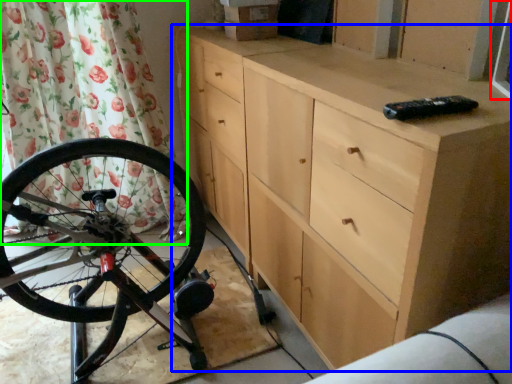
Question: Considering the real-world distances, which object is farthest from window screen (highlighted by a red box)? chest of drawers (highlighted by a blue box) or shower curtain (highlighted by a green box)?

Choices:
 (A) chest of drawers
 (B) shower curtain

Answer: (B)